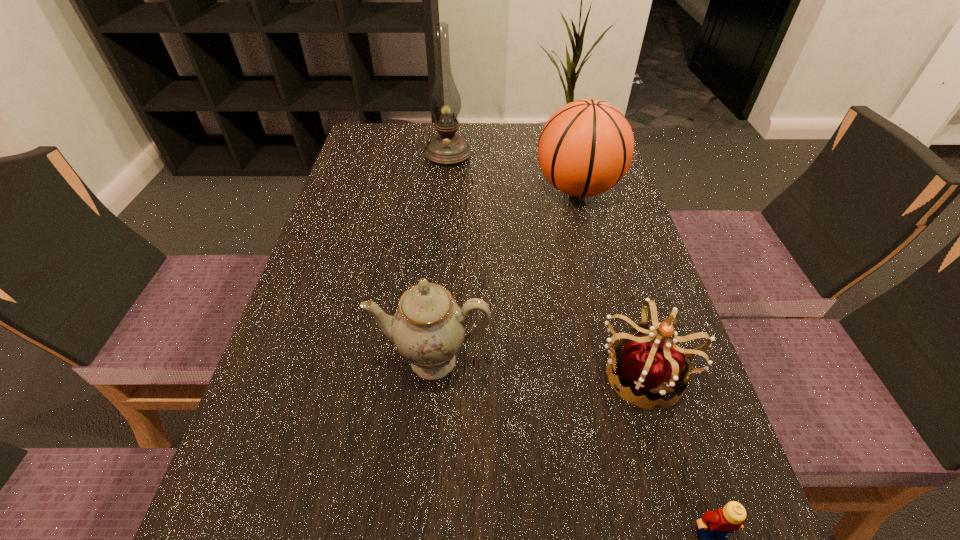
This screenshot has height=540, width=960. Identify the location of basketball positioned at the right edge. (586, 147).

At what (x,y) coordinates should I click in order to perform the action: click on tiara at the right edge. Please return your answer as a coordinate pair (x, y). Looking at the image, I should click on (653, 365).

The height and width of the screenshot is (540, 960). In order to click on object that is positioned at the far right corner in this screenshot , I will do `click(586, 147)`.

This screenshot has width=960, height=540. In order to click on vacant space at the far edge of the desktop in this screenshot , I will do `click(525, 158)`.

Find the location of a particular element. vacant space at the left edge of the desktop is located at coordinates (342, 235).

This screenshot has height=540, width=960. Identify the location of vacant space at the right edge of the desktop. (628, 238).

Locate an element on the screen. vacant space that's between the basketball and the tallest object is located at coordinates (513, 171).

What are the coordinates of `free area in between the chinaware and the oil lamp` in the screenshot? It's located at (441, 258).

Identify the location of free spot between the oil lamp and the basketball. This screenshot has height=540, width=960. (513, 171).

Where is `empty space between the oil lamp and the chinaware`? The width and height of the screenshot is (960, 540). empty space between the oil lamp and the chinaware is located at coordinates (441, 258).